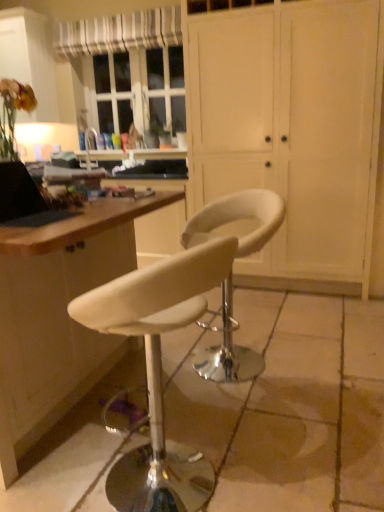
Where is `free space below white leather stool at center, which appears as the first chair when viewed from the back (from a real-world perspective)`? free space below white leather stool at center, which appears as the first chair when viewed from the back (from a real-world perspective) is located at coordinates (241, 364).